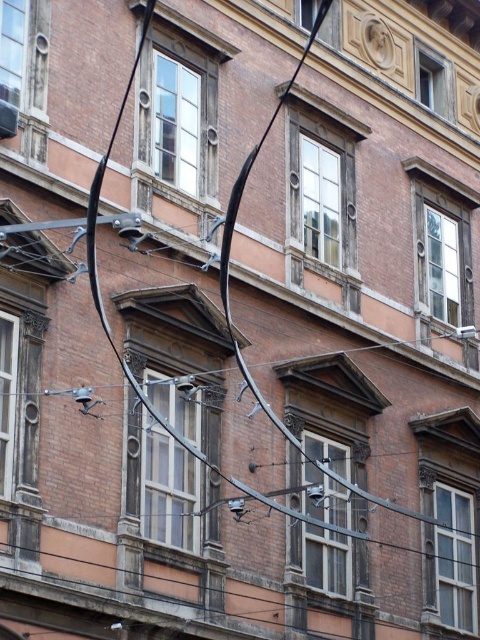
You are an architect analyzing the building facade. You need to determine which window is shorter between the matte brick window at center and the clear glass window at upper left. Which one is shorter?

The matte brick window at center is shorter than the clear glass window at upper left according to the description.

You are standing directly in front of the building and want to locate the matte brick window at center. Based on the coordinates provided, where would you look relative to the building?

The matte brick window at center is located at the coordinates point (x=171, y=330), which would be near the middle of the building slightly to the right and a third of the way up from the bottom.

You are an architect designing a new building and want to ensure that all windows have the same width. You notice the matte brick window at center and the clear glass window at upper left in the reference image. Which window should you adjust to match the other in terms of width?

The matte brick window at center has a smaller width than the clear glass window at upper left. To make them the same, you should widen the matte brick window at center to match the width of the clear glass window at upper left.